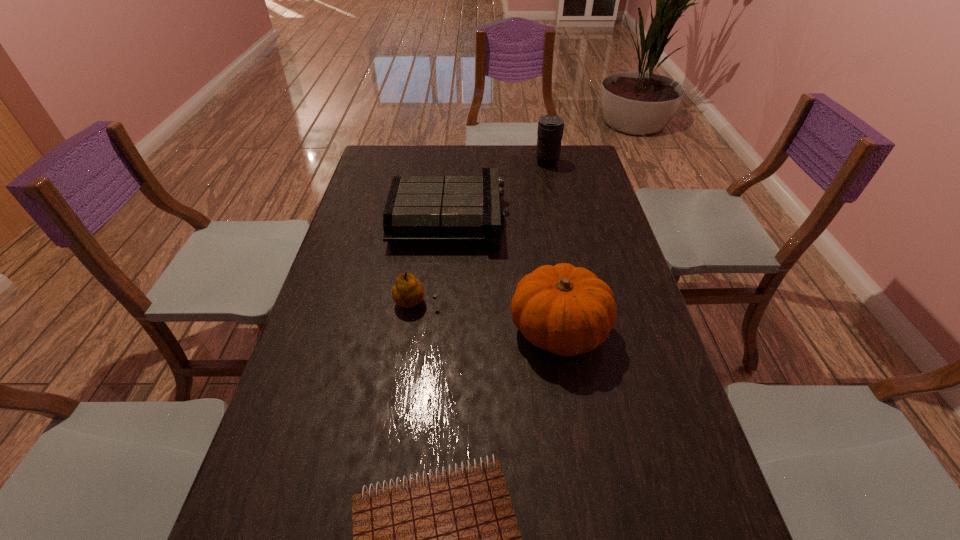
Where is `telephoto lens`? This screenshot has height=540, width=960. telephoto lens is located at coordinates (550, 127).

Find the location of a particular element. pumpkin is located at coordinates point(567,310).

Locate an element on the screen. The image size is (960, 540). pear is located at coordinates (408, 291).

This screenshot has height=540, width=960. Identify the location of radio receiver. (419, 208).

This screenshot has width=960, height=540. What are the coordinates of `free point located 0.100m on the side of the farthest object where the control switches are located` in the screenshot? It's located at (510, 163).

The width and height of the screenshot is (960, 540). Identify the location of free region located 0.340m on the side of the farthest object where the control switches are located. (449, 163).

You are a GUI agent. You are given a task and a screenshot of the screen. Output one action in this format:
    pyautogui.click(x=<x>, y=<y>)
    Task: Click on the free space located on the side of the farthest object where the control switches are located
    This screenshot has width=960, height=540.
    Given the screenshot: What is the action you would take?
    pyautogui.click(x=504, y=163)

The height and width of the screenshot is (540, 960). I want to click on free space located on the front of the pumpkin, so click(573, 417).

The width and height of the screenshot is (960, 540). I want to click on free space located on the left of the pear, so pyautogui.click(x=333, y=302).

Image resolution: width=960 pixels, height=540 pixels. Identify the location of vacant area situated on the front panel of the fourth nearest object. (599, 220).